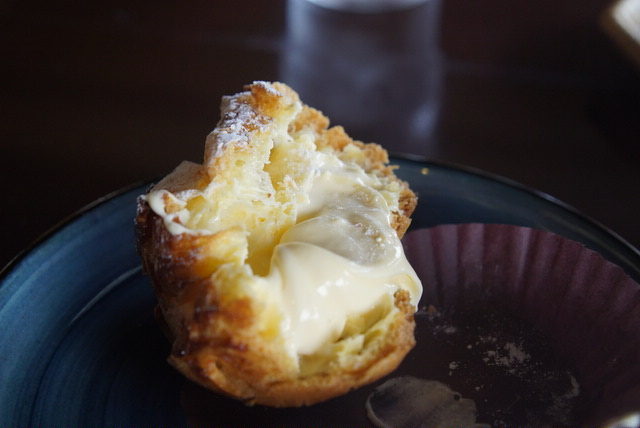
Locate an element on the screen. The width and height of the screenshot is (640, 428). blue bowl is located at coordinates (67, 262).